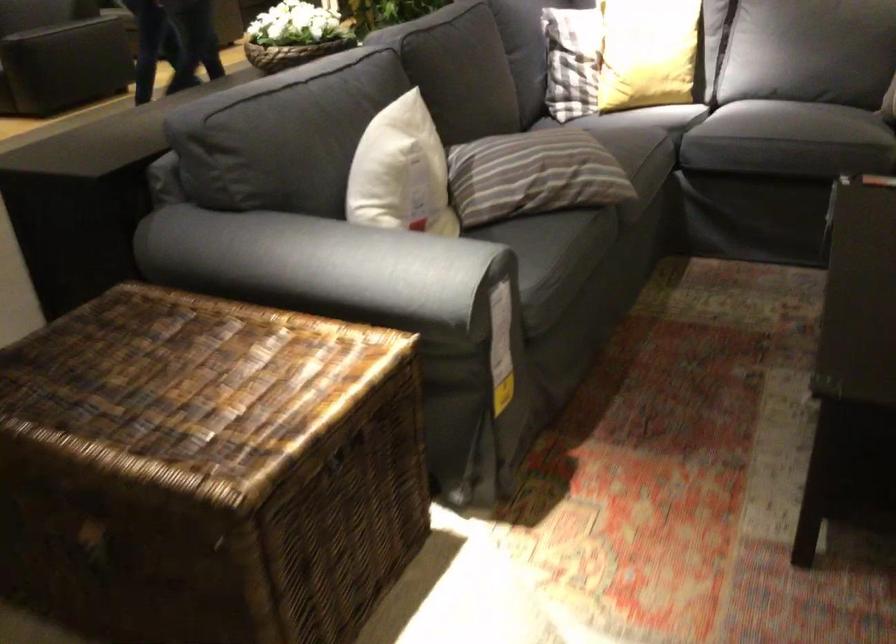
Describe the element at coordinates (533, 174) in the screenshot. This screenshot has width=896, height=644. I see `the striped pillow` at that location.